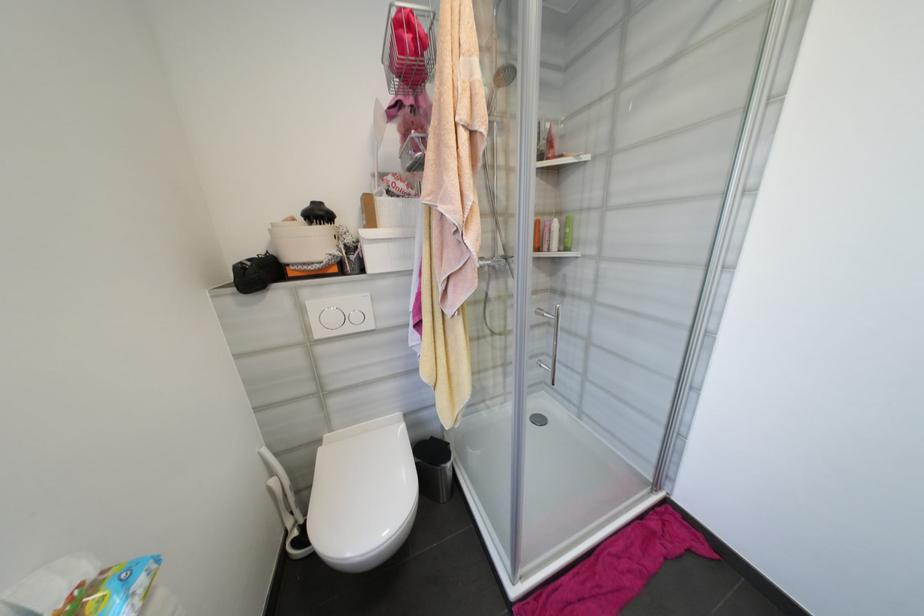
Where is `shower door handle`? This screenshot has width=924, height=616. shower door handle is located at coordinates (551, 341).